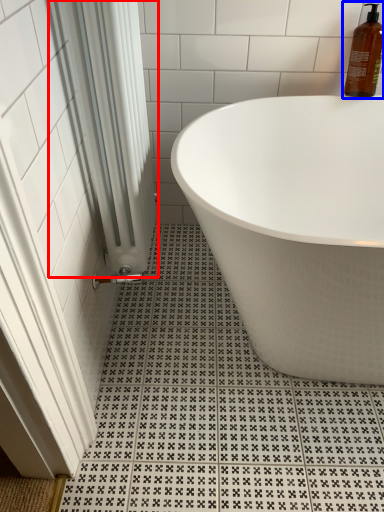
Question: Which object appears farthest to the camera in this image, shower curtain (highlighted by a red box) or cleaning product (highlighted by a blue box)?

Choices:
 (A) shower curtain
 (B) cleaning product

Answer: (B)